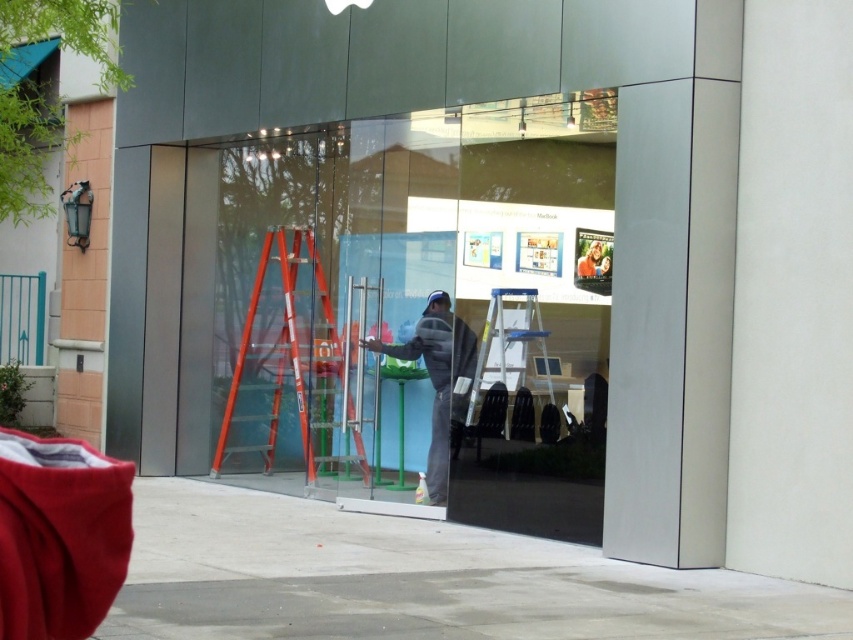
Can you confirm if blue metallic ladder at center is shorter than gray fleece jacket at center?

Yes, blue metallic ladder at center is shorter than gray fleece jacket at center.

Can you confirm if blue metallic ladder at center is thinner than gray fleece jacket at center?

Yes, blue metallic ladder at center is thinner than gray fleece jacket at center.

Which is behind, point (537, 307) or point (427, 369)?

The point (427, 369) is more distant.

You are a GUI agent. You are given a task and a screenshot of the screen. Output one action in this format:
    pyautogui.click(x=<x>, y=<y>)
    Task: Click on the blue metallic ladder at center
    
    Given the screenshot: What is the action you would take?
    pyautogui.click(x=512, y=355)

Is blue metallic ladder at center shorter than smooth gray shirt at center?

No, blue metallic ladder at center is not shorter than smooth gray shirt at center.

Which is behind, point (500, 356) or point (590, 260)?

The point (500, 356) is more distant.

Identify the location of blue metallic ladder at center. (512, 355).

Who is more distant from viewer, (321, 285) or (589, 253)?

The point (321, 285) is behind.

Measure the distance between point (312, 433) and camera.

Point (312, 433) and camera are 12.14 meters apart from each other.

I want to click on orange fiberglass ladder at center, so click(294, 364).